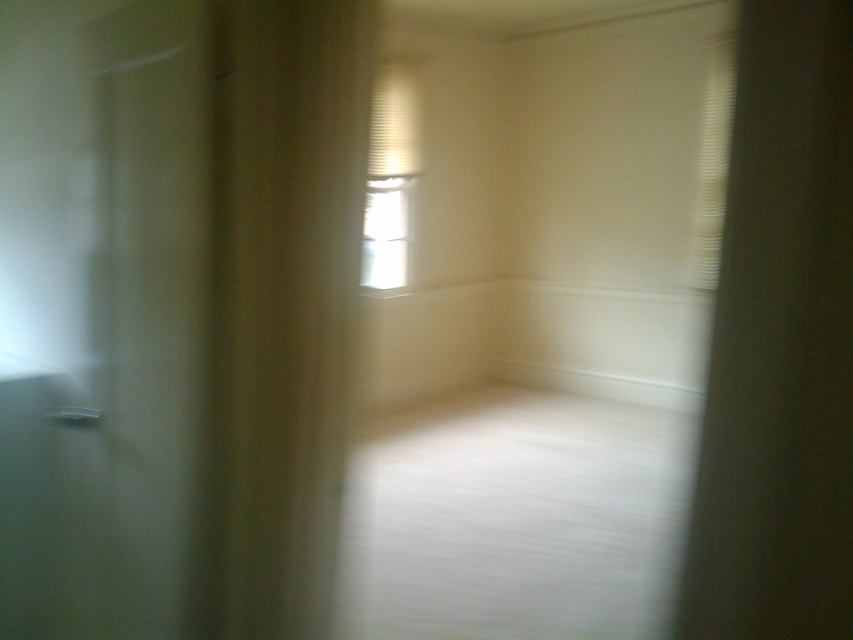
Question: Does beige fabric curtain at left appear under transparent glass window at center?

Choices:
 (A) yes
 (B) no

Answer: (A)

Question: Can you confirm if beige fabric curtain at left is thinner than transparent glass window at center?

Choices:
 (A) no
 (B) yes

Answer: (A)

Question: Which object is farther from the camera taking this photo?

Choices:
 (A) transparent glass window at center
 (B) beige fabric curtain at left

Answer: (A)

Question: Which point is closer to the camera?

Choices:
 (A) transparent glass window at center
 (B) beige fabric curtain at left

Answer: (B)

Question: Does beige fabric curtain at left have a smaller size compared to transparent glass window at center?

Choices:
 (A) yes
 (B) no

Answer: (B)